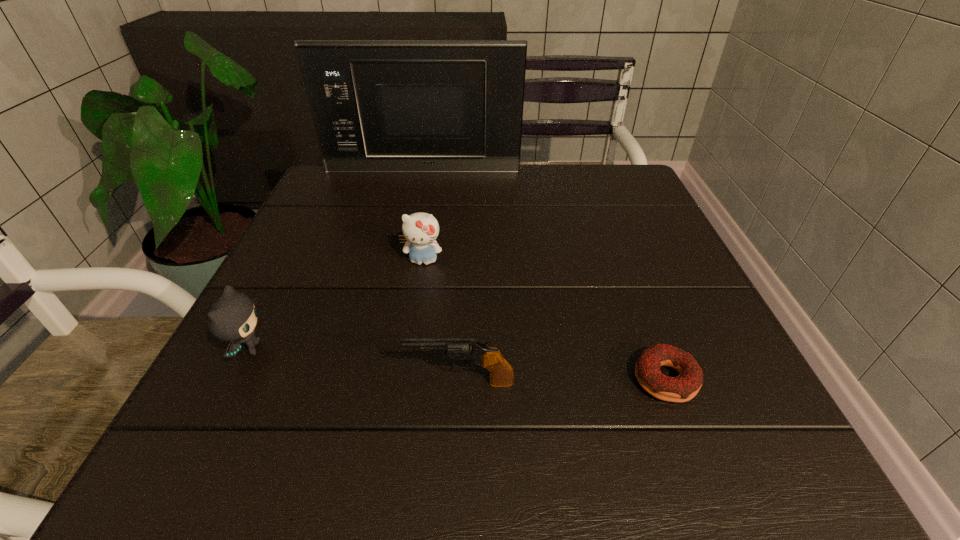
What are the coordinates of `the tallest object` in the screenshot? It's located at (417, 106).

Identify the location of the farthest object. (417, 106).

I want to click on the farther kitten, so click(420, 229).

Identify the location of the fourth nearest object. (420, 229).

Where is `the left kitten`? This screenshot has width=960, height=540. the left kitten is located at coordinates (232, 317).

Locate an element on the screen. gun is located at coordinates (501, 373).

This screenshot has height=540, width=960. In order to click on doughnut in this screenshot , I will do `click(682, 388)`.

In order to click on the rightmost object in this screenshot , I will do `click(682, 388)`.

The height and width of the screenshot is (540, 960). Find the location of `blank space located on the front panel of the microwave oven`. blank space located on the front panel of the microwave oven is located at coordinates (420, 191).

At what (x,y) coordinates should I click in order to perform the action: click on vacant space located 0.200m on the front-facing side of the second farthest object. Please return your answer as a coordinate pair (x, y). This screenshot has height=540, width=960. Looking at the image, I should click on (409, 352).